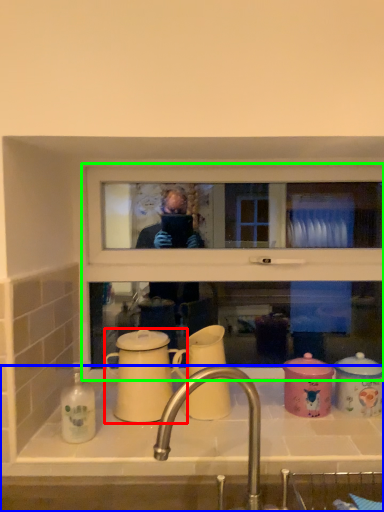
Question: Considering the real-world distances, which object is closest to coffee cup (highlighted by a red box)? sink (highlighted by a blue box) or window frame (highlighted by a green box).

Choices:
 (A) sink
 (B) window frame

Answer: (A)